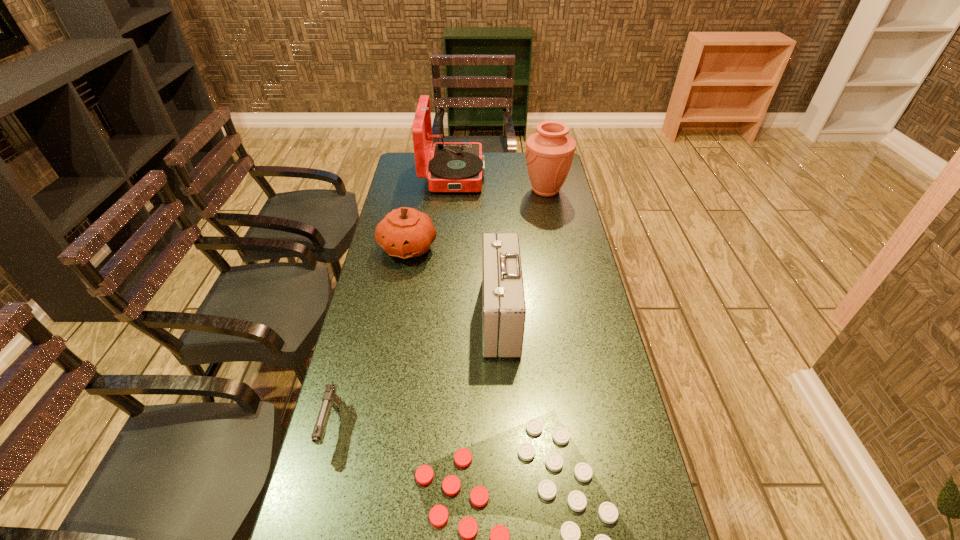
The height and width of the screenshot is (540, 960). Find the location of `vacant area located on the front-facing side of the third tallest object`. vacant area located on the front-facing side of the third tallest object is located at coordinates (371, 316).

At what (x,y) coordinates should I click in order to perform the action: click on free space located 0.380m on the front-facing side of the third tallest object. Please return your answer as a coordinate pair (x, y). Looking at the image, I should click on (361, 316).

Locate an element on the screen. vacant region located on the front-facing side of the pumpkin is located at coordinates (397, 301).

You are a GUI agent. You are given a task and a screenshot of the screen. Output one action in this format:
    pyautogui.click(x=<x>, y=<y>)
    Task: Click on the vacant space located 0.160m in the direction the gun is aimed
    
    Given the screenshot: What is the action you would take?
    pyautogui.click(x=304, y=531)

Where is `object that is at the far edge`? The image size is (960, 540). object that is at the far edge is located at coordinates (454, 166).

You are a GUI agent. You are given a task and a screenshot of the screen. Output one action in this format:
    pyautogui.click(x=<x>, y=<y>)
    Task: Click on the phonograph_record positioned at the left edge
    Image resolution: width=960 pixels, height=540 pixels.
    Given the screenshot: What is the action you would take?
    click(454, 166)

Where is `pumpkin located in the left edge section of the desktop`? The height and width of the screenshot is (540, 960). pumpkin located in the left edge section of the desktop is located at coordinates (405, 232).

At what (x,y) coordinates should I click in order to perform the action: click on gun situated at the left edge. Please return your answer as a coordinate pair (x, y). The image size is (960, 540). Looking at the image, I should click on (330, 399).

You are a GUI agent. You are given a task and a screenshot of the screen. Output one action in this format:
    pyautogui.click(x=<x>, y=<y>)
    Task: Click on the object located at the right edge
    This screenshot has width=960, height=540.
    Given the screenshot: What is the action you would take?
    pyautogui.click(x=549, y=153)

Find the location of a particular element. This screenshot has height=540, width=960. object that is at the far left corner is located at coordinates pyautogui.click(x=454, y=166).